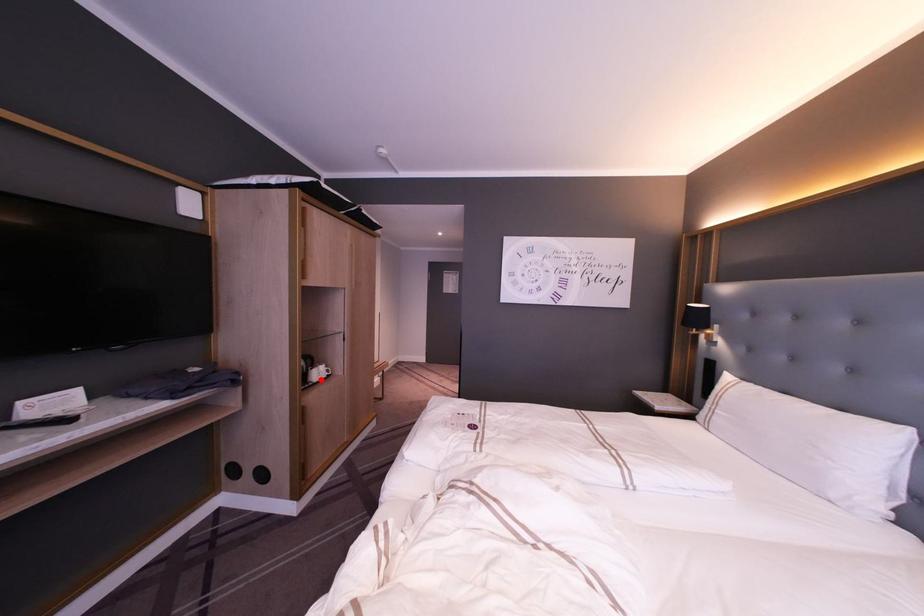
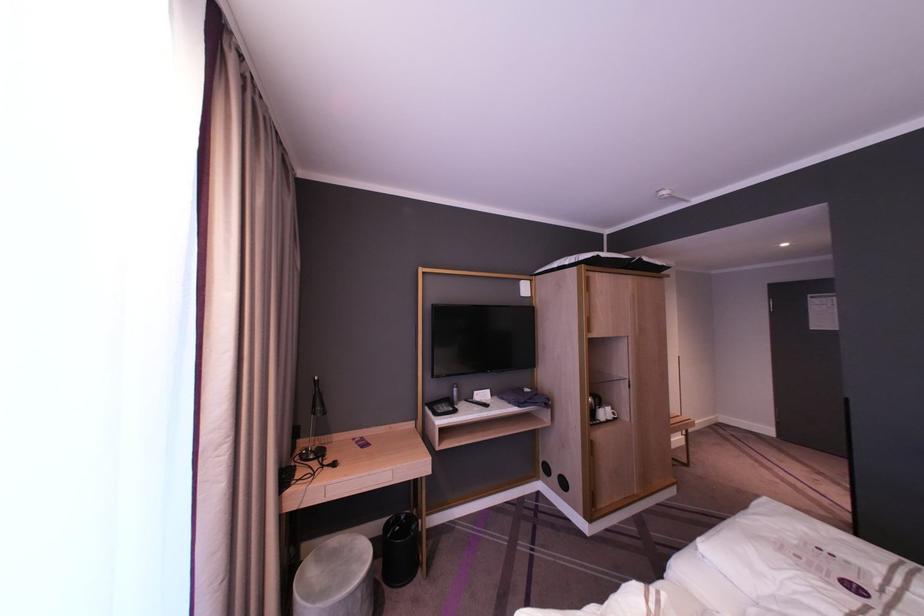
Question: I am providing you with two images of the same scene from different viewpoints. Image1 has a red point marked. In image2, the corresponding 3D location appears at what relative position? Reply with the corresponding letter.

Choices:
 (A) Closer
 (B) Farther

Answer: (B)